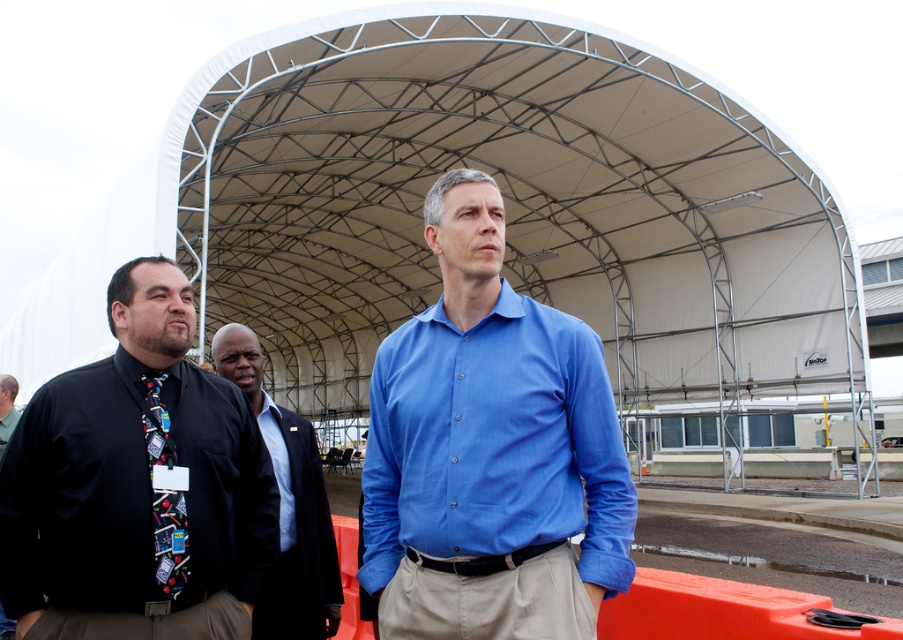
Question: Is multicolored fabric tie at left above light blue cotton shirt at center?

Choices:
 (A) yes
 (B) no

Answer: (A)

Question: Which of the following is the farthest from the observer?

Choices:
 (A) (442, 268)
 (B) (172, 563)
 (C) (235, 356)

Answer: (C)

Question: Which point is farther to the camera?

Choices:
 (A) (503, 285)
 (B) (278, 483)
 (C) (14, 387)
 (D) (241, 369)

Answer: (C)

Question: Can you confirm if black matte shirt at left is positioned to the left of black tie at left?

Choices:
 (A) yes
 (B) no

Answer: (B)

Question: Among these points, which one is farthest from the camera?

Choices:
 (A) (616, 568)
 (B) (0, 419)
 (C) (96, 477)
 (D) (298, 541)

Answer: (B)

Question: Can you confirm if black matte shirt at left is wider than dark blue suit at center?

Choices:
 (A) no
 (B) yes

Answer: (B)